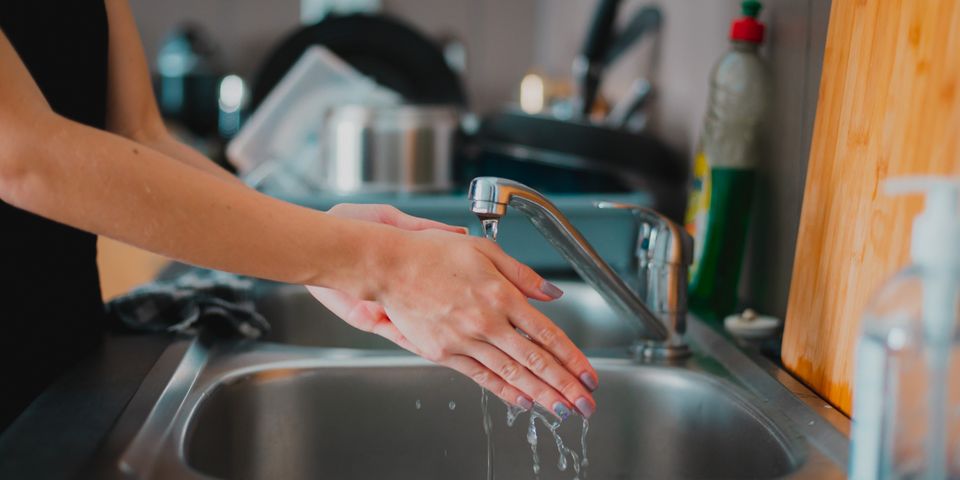
This screenshot has height=480, width=960. I want to click on washing sink, so click(x=289, y=324).